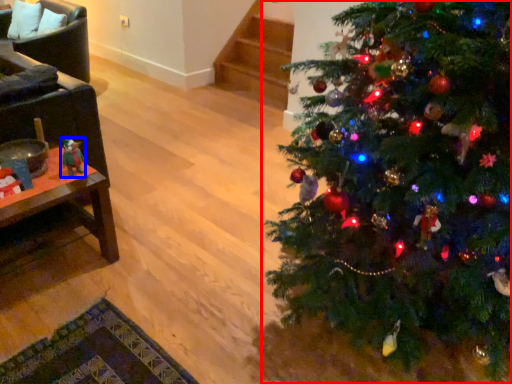
Question: Which of the following is the closest to the observer, christmas tree (highlighted by a red box) or toy (highlighted by a blue box)?

Choices:
 (A) christmas tree
 (B) toy

Answer: (A)